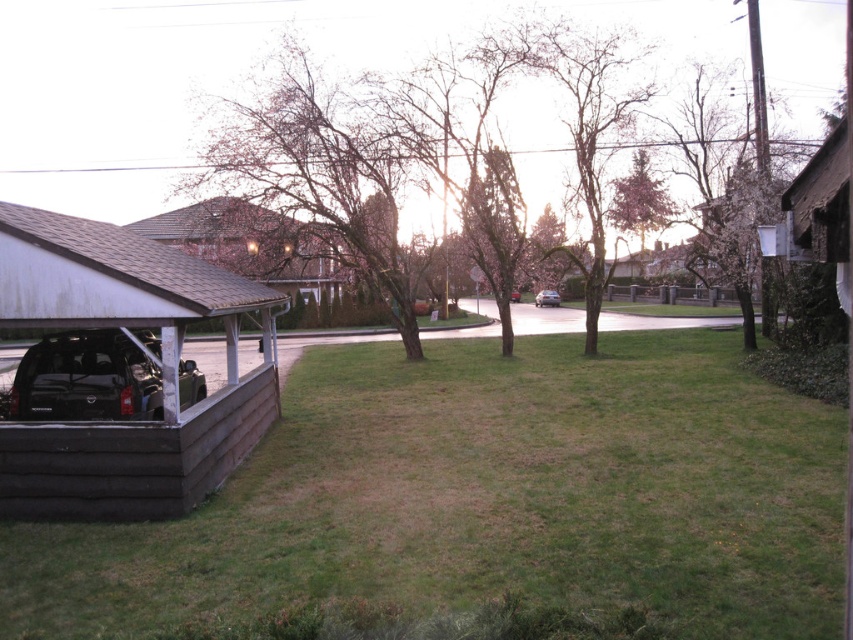
Question: Which object appears closest to the camera in this image?

Choices:
 (A) green grass at lower center
 (B) brown shingled hut at left
 (C) satin silver sedan at center

Answer: (A)

Question: Is wooden carport at lower left above satin silver sedan at center?

Choices:
 (A) yes
 (B) no

Answer: (B)

Question: Is satin silver sedan at center smaller than metallic silver sedan at center?

Choices:
 (A) no
 (B) yes

Answer: (B)

Question: Which object is farther from the camera taking this photo?

Choices:
 (A) brown shingled hut at left
 (B) black matte suv at lower left
 (C) satin silver sedan at center
 (D) metallic silver sedan at center

Answer: (C)

Question: Where is green grass at lower center located in relation to metallic silver sedan at center in the image?

Choices:
 (A) right
 (B) left

Answer: (B)

Question: Which is farther from the satin silver sedan at center?

Choices:
 (A) green grass at lower center
 (B) brown shingled hut at left

Answer: (A)